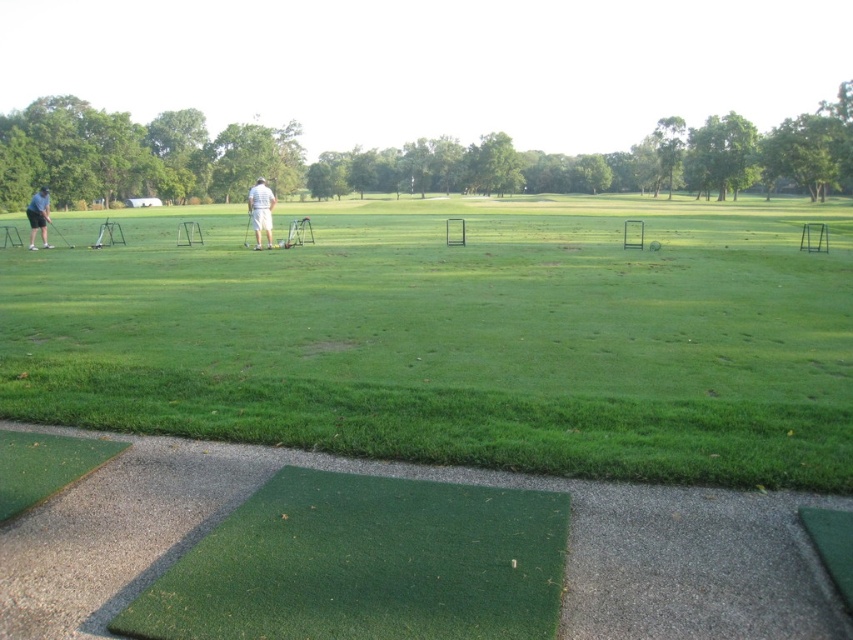
Is light blue shirt at left below shiny silver golf club at left?

Actually, light blue shirt at left is above shiny silver golf club at left.

Between point (42, 204) and point (71, 248), which one is positioned in front?

Positioned in front is point (42, 204).

Identify the location of light blue shirt at left. This screenshot has height=640, width=853. (38, 216).

Which of these two, green grass at lower left or shiny silver golf club at left, stands shorter?

Standing shorter between the two is shiny silver golf club at left.

Who is more distant from viewer, [73,320] or [55,228]?

Point [55,228]

The width and height of the screenshot is (853, 640). What are the coordinates of `green grass at lower left` in the screenshot? It's located at (459, 340).

Is green grass at lower left to the right of light blue shirt at left from the viewer's perspective?

Yes, green grass at lower left is to the right of light blue shirt at left.

Does green grass at lower left come in front of light blue shirt at left?

That is True.

Who is more forward, (816, 285) or (30, 198)?

Point (816, 285)

Identify the location of green grass at lower left. The image size is (853, 640). (459, 340).